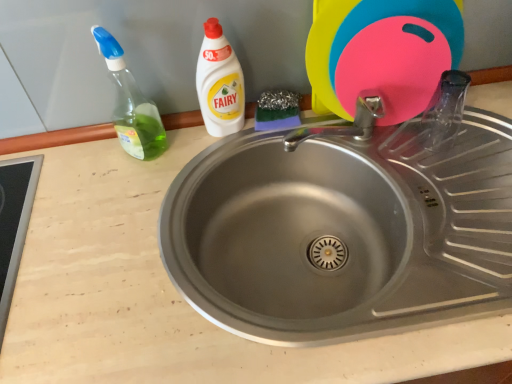
You are a GUI agent. You are given a task and a screenshot of the screen. Output one action in this format:
    pyautogui.click(x=<x>, y=<y>)
    Task: Click on the free spot in front of green translucent bottle at left
    The width and height of the screenshot is (512, 384).
    Given the screenshot: What is the action you would take?
    [126, 203]